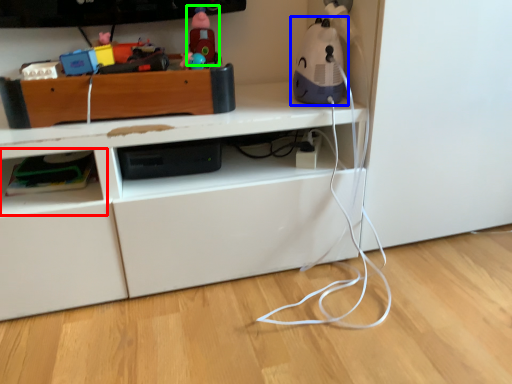
Question: Which object is the closest to the shelf (highlighted by a red box)? Choose among these: toy (highlighted by a blue box) or toy (highlighted by a green box).

Choices:
 (A) toy
 (B) toy

Answer: (B)